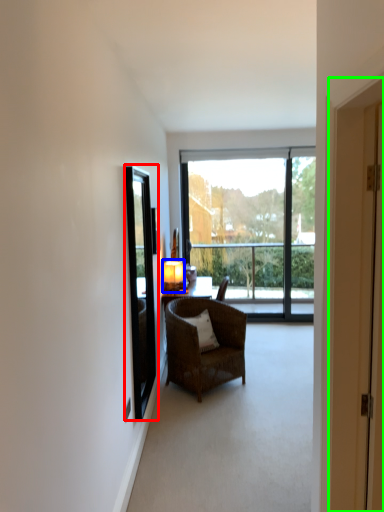
Question: Considering the real-world distances, which object is farthest from window screen (highlighted by a red box)? light (highlighted by a blue box) or door (highlighted by a green box)?

Choices:
 (A) light
 (B) door

Answer: (B)